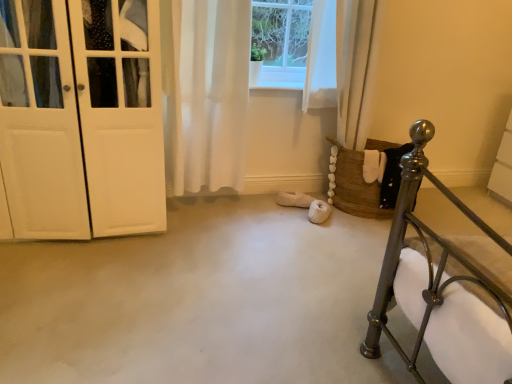
Question: Does white sheer curtain at center have a lesser height compared to white matte door at left?

Choices:
 (A) no
 (B) yes

Answer: (B)

Question: Would you say white sheer curtain at center is a long distance from white matte door at left?

Choices:
 (A) no
 (B) yes

Answer: (A)

Question: Does white sheer curtain at center have a greater height compared to white matte door at left?

Choices:
 (A) no
 (B) yes

Answer: (A)

Question: Is white sheer curtain at center smaller than white matte door at left?

Choices:
 (A) no
 (B) yes

Answer: (B)

Question: Is white sheer curtain at center to the left of white matte door at left from the viewer's perspective?

Choices:
 (A) yes
 (B) no

Answer: (B)

Question: From a real-world perspective, is white sheer curtain at center located beneath white matte door at left?

Choices:
 (A) no
 (B) yes

Answer: (A)

Question: Is white sheer curtain at center located within white matte door at left?

Choices:
 (A) yes
 (B) no

Answer: (B)

Question: Is white matte door at left bigger than white sheer curtain at center?

Choices:
 (A) yes
 (B) no

Answer: (A)

Question: From the image's perspective, would you say white matte door at left is shown under white sheer curtain at center?

Choices:
 (A) yes
 (B) no

Answer: (A)

Question: Is white matte door at left thinner than white sheer curtain at center?

Choices:
 (A) no
 (B) yes

Answer: (A)

Question: Is white matte door at left to the left of white sheer curtain at center from the viewer's perspective?

Choices:
 (A) yes
 (B) no

Answer: (A)

Question: Is white matte door at left not within white sheer curtain at center?

Choices:
 (A) no
 (B) yes

Answer: (B)

Question: From the image's perspective, relative to white matte door at left, is white sheer curtain at center above or below?

Choices:
 (A) above
 (B) below

Answer: (A)